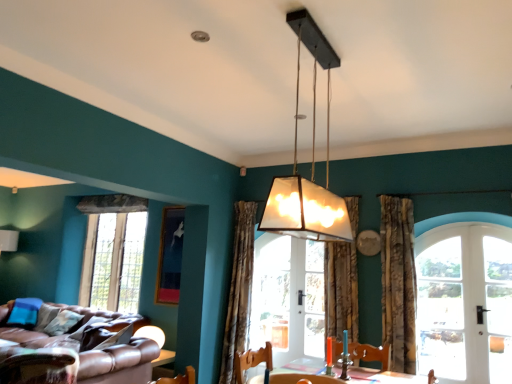
Question: From the image's perspective, is wooden swivel chair at lower center, which ranks as the second swivel chair in left-to-right order, under clear glass window at left, arranged as the second window when viewed from the front?

Choices:
 (A) no
 (B) yes

Answer: (B)

Question: Can you confirm if wooden swivel chair at lower center, the first swivel chair in the right-to-left sequence, is shorter than clear glass window at left, which is counted as the 1th window, starting from the back?

Choices:
 (A) no
 (B) yes

Answer: (B)

Question: Considering the relative sizes of wooden swivel chair at lower center, which ranks as the second swivel chair in left-to-right order, and clear glass window at left, which appears as the first window when viewed from the left, in the image provided, is wooden swivel chair at lower center, which ranks as the second swivel chair in left-to-right order, wider than clear glass window at left, which appears as the first window when viewed from the left,?

Choices:
 (A) no
 (B) yes

Answer: (B)

Question: Is wooden swivel chair at lower center, which ranks as the second swivel chair in left-to-right order, bigger than clear glass window at left, which appears as the first window when viewed from the left?

Choices:
 (A) no
 (B) yes

Answer: (A)

Question: Is wooden swivel chair at lower center, the first swivel chair in the right-to-left sequence, oriented away from clear glass window at left, arranged as the second window when viewed from the front?

Choices:
 (A) no
 (B) yes

Answer: (A)

Question: Based on their sizes in the image, would you say clear glass window at left, which is counted as the 1th window, starting from the back, is bigger or smaller than floral fabric curtain at right, acting as the 3th curtain starting from the left?

Choices:
 (A) small
 (B) big

Answer: (B)

Question: From the image's perspective, is clear glass window at left, which appears as the first window when viewed from the left, located above or below floral fabric curtain at right, which is counted as the 1th curtain, starting from the right?

Choices:
 (A) above
 (B) below

Answer: (B)

Question: Is point (81, 201) closer or farther from the camera than point (409, 347)?

Choices:
 (A) closer
 (B) farther

Answer: (B)

Question: Is clear glass window at left, which ranks as the 2th window in right-to-left order, wider or thinner than floral fabric curtain at right, which is counted as the 1th curtain, starting from the right?

Choices:
 (A) wide
 (B) thin

Answer: (B)

Question: From their relative heights in the image, would you say clear glass window at left, arranged as the second window when viewed from the front, is taller or shorter than leather swivel chair at lower left, which ranks as the first swivel chair in left-to-right order?

Choices:
 (A) tall
 (B) short

Answer: (A)

Question: Is clear glass window at left, which is counted as the 1th window, starting from the back, bigger or smaller than leather swivel chair at lower left, acting as the 2th swivel chair starting from the right?

Choices:
 (A) small
 (B) big

Answer: (B)

Question: From a real-world perspective, is clear glass window at left, which ranks as the 2th window in right-to-left order, positioned above or below leather swivel chair at lower left, acting as the 2th swivel chair starting from the right?

Choices:
 (A) above
 (B) below

Answer: (A)

Question: Visually, is clear glass window at left, which appears as the first window when viewed from the left, positioned to the left or to the right of leather swivel chair at lower left, which ranks as the first swivel chair in left-to-right order?

Choices:
 (A) right
 (B) left

Answer: (B)

Question: Based on their sizes in the image, would you say textured beige curtain at center, which ranks as the second curtain in right-to-left order, is bigger or smaller than floral fabric curtain at right, acting as the 3th curtain starting from the left?

Choices:
 (A) small
 (B) big

Answer: (A)

Question: From a real-world perspective, is textured beige curtain at center, which ranks as the second curtain in right-to-left order, physically located above or below floral fabric curtain at right, acting as the 3th curtain starting from the left?

Choices:
 (A) below
 (B) above

Answer: (A)